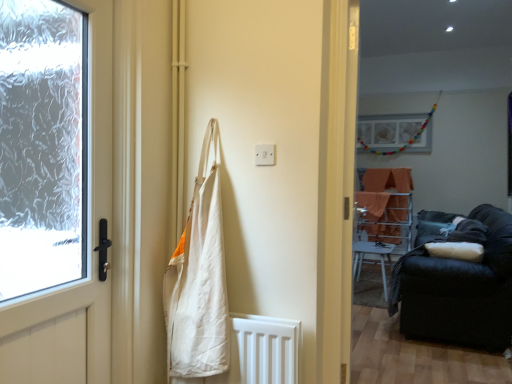
Question: Considering the relative positions of velvet dark blue couch at right and matte white door at left in the image provided, is velvet dark blue couch at right to the left or to the right of matte white door at left?

Choices:
 (A) left
 (B) right

Answer: (B)

Question: Do you think velvet dark blue couch at right is within matte white door at left, or outside of it?

Choices:
 (A) inside
 (B) outside

Answer: (B)

Question: Which object is the closest to the orange fabric at center?

Choices:
 (A) white plastic chair at center
 (B) velvet dark blue couch at right
 (C) black fabric couch at right
 (D) matte white door at left
 (E) white canvas bag at center

Answer: (A)

Question: Which of these objects is positioned farthest from the orange fabric at center?

Choices:
 (A) matte white door at left
 (B) white plastic chair at center
 (C) white canvas bag at center
 (D) black fabric couch at right
 (E) velvet dark blue couch at right

Answer: (A)